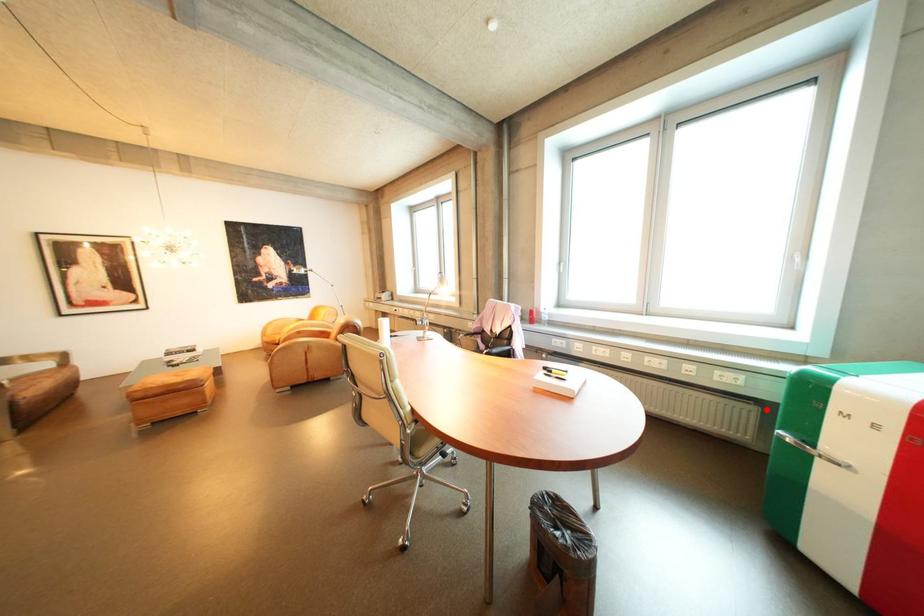
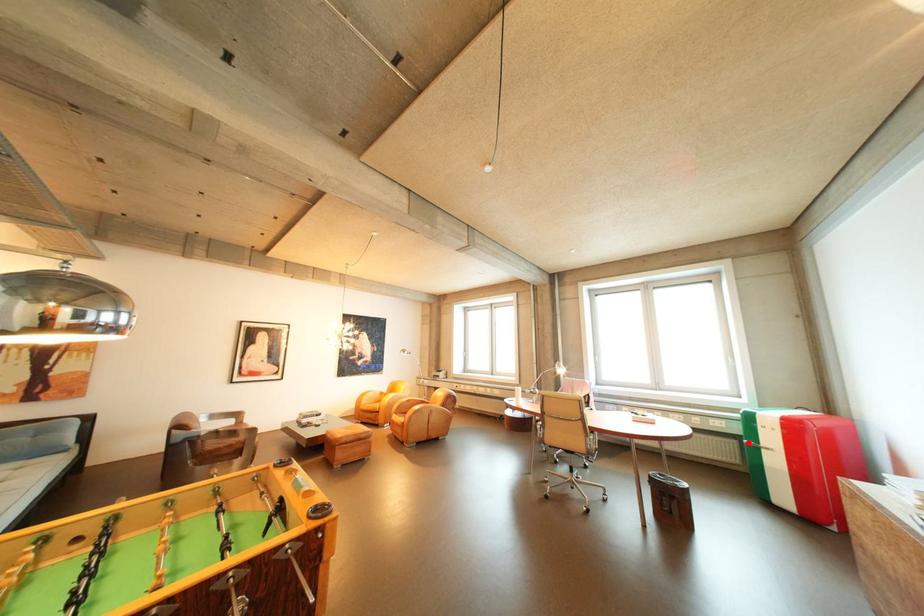
I am providing you with two images of the same scene from different viewpoints. A red point is marked on the first image and another point is marked on the second image. Do the highlighted points in image1 and image2 indicate the same real-world spot?

Yes